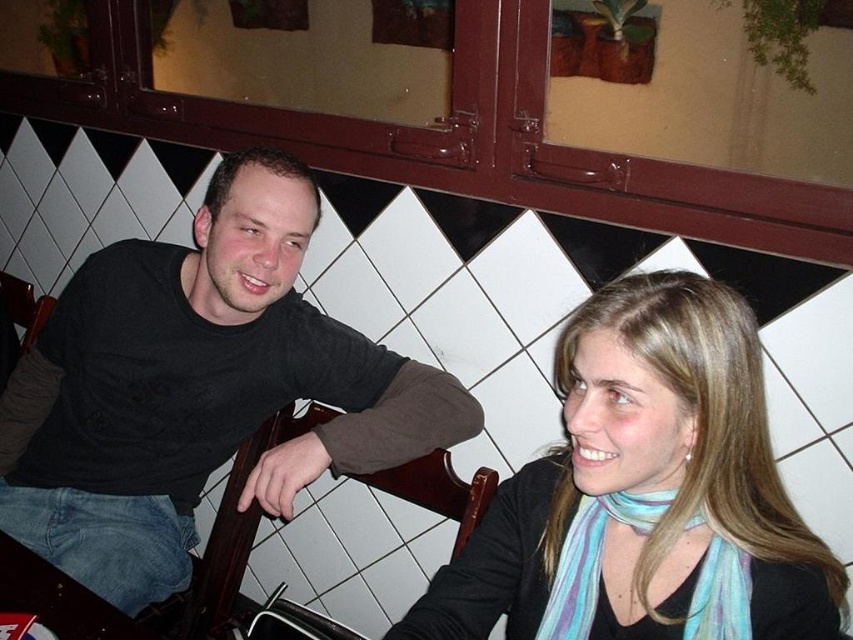
Question: Is black cotton shirt at center wider than light blue scarf at center?

Choices:
 (A) no
 (B) yes

Answer: (B)

Question: Which point is closer to the camera taking this photo?

Choices:
 (A) (614, 337)
 (B) (236, 208)

Answer: (A)

Question: Does black cotton shirt at center have a lesser width compared to light blue scarf at center?

Choices:
 (A) yes
 (B) no

Answer: (B)

Question: Among these objects, which one is farthest from the camera?

Choices:
 (A) light blue scarf at center
 (B) black cotton shirt at center

Answer: (B)

Question: Which point appears closest to the camera in this image?

Choices:
 (A) (747, 376)
 (B) (16, 397)

Answer: (A)

Question: Considering the relative positions of black cotton shirt at center and light blue scarf at center in the image provided, where is black cotton shirt at center located with respect to light blue scarf at center?

Choices:
 (A) left
 (B) right

Answer: (A)